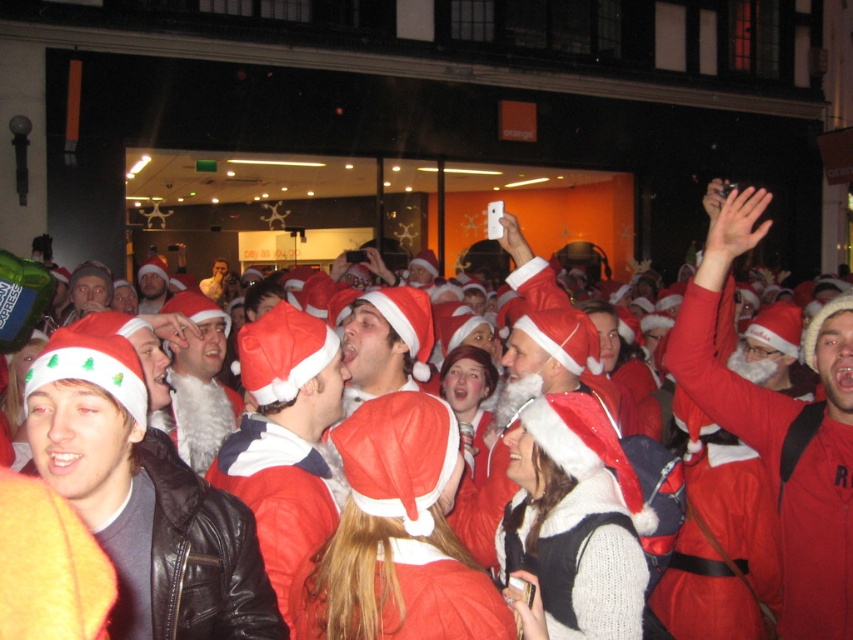
Does point (198, 484) come behind point (219, 310)?

No, it is in front of (219, 310).

Does matte black jacket at center have a lesser height compared to white fluffy santa hat at center?

In fact, matte black jacket at center may be taller than white fluffy santa hat at center.

You are a GUI agent. You are given a task and a screenshot of the screen. Output one action in this format:
    pyautogui.click(x=<x>, y=<y>)
    Task: Click on the matte black jacket at center
    Image resolution: width=853 pixels, height=640 pixels.
    Given the screenshot: What is the action you would take?
    pyautogui.click(x=144, y=499)

Identify the location of matte black jacket at center. (144, 499).

Is red matte santa hat at upper right to the right of red santa hat at center from the viewer's perspective?

Correct, you'll find red matte santa hat at upper right to the right of red santa hat at center.

You are a GUI agent. You are given a task and a screenshot of the screen. Output one action in this format:
    pyautogui.click(x=<x>, y=<y>)
    Task: Click on the red matte santa hat at upper right
    
    Given the screenshot: What is the action you would take?
    pyautogui.click(x=781, y=428)

Based on the photo, who is more distant from viewer, (811, 442) or (262, 356)?

Point (811, 442)

I want to click on red matte santa hat at upper right, so click(781, 428).

Based on the photo, is red matte santa hat at upper right to the left of white fluffy santa hat at center from the viewer's perspective?

Incorrect, red matte santa hat at upper right is not on the left side of white fluffy santa hat at center.

I want to click on red matte santa hat at upper right, so click(781, 428).

Identify the location of red matte santa hat at upper right. Image resolution: width=853 pixels, height=640 pixels. (781, 428).